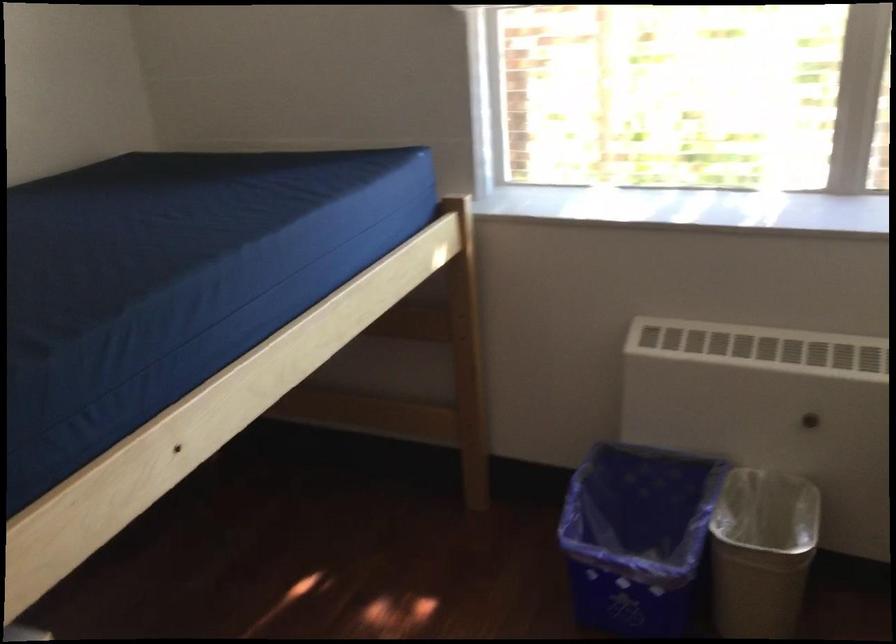
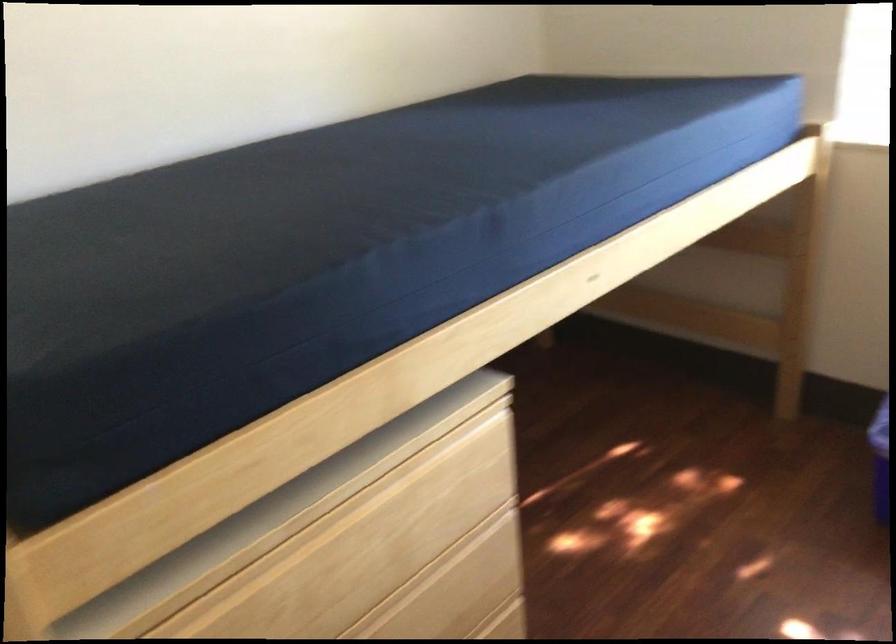
The point at (474, 362) is marked in the first image. Where is the corresponding point in the second image?

(803, 275)